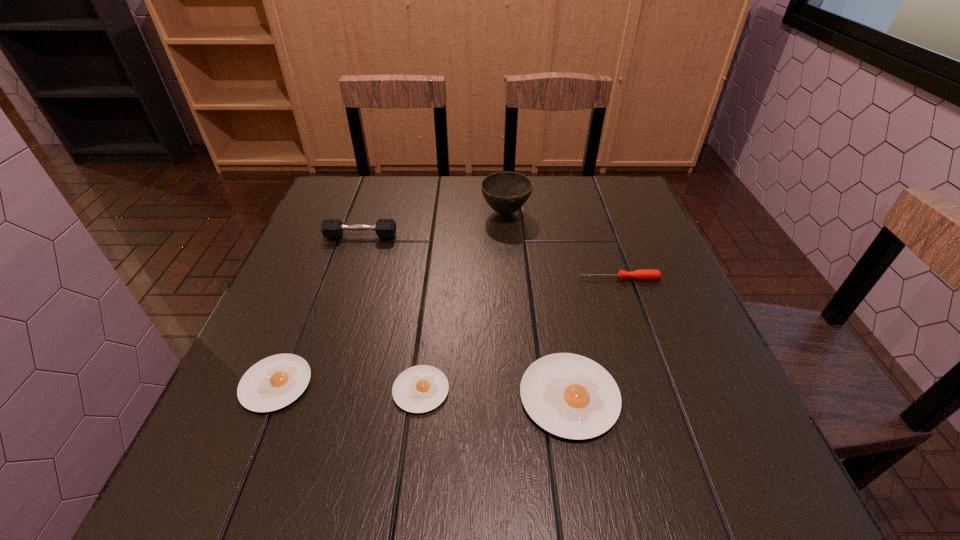
What are the coordinates of `free spot located on the right of the second shortest object` in the screenshot? It's located at (448, 384).

Identify the location of vacant area located 0.280m on the back of the second egg yolk from right to left. 435,269.

Where is `vacant space situated 0.120m on the back of the rightmost egg yolk`? Image resolution: width=960 pixels, height=540 pixels. vacant space situated 0.120m on the back of the rightmost egg yolk is located at coordinates (555, 312).

The height and width of the screenshot is (540, 960). What are the coordinates of `vacant region located at the tip of the fourth nearest object` in the screenshot? It's located at (549, 279).

Where is `free location located at the tip of the fourth nearest object`? This screenshot has height=540, width=960. free location located at the tip of the fourth nearest object is located at coordinates click(418, 279).

Locate an element on the screen. The image size is (960, 540). vacant point located 0.270m at the tip of the fourth nearest object is located at coordinates (462, 279).

In order to click on vacant space located on the right of the tallest object in this screenshot , I will do `click(586, 213)`.

Identify the location of vacant area situated on the front of the dumbbell. This screenshot has height=540, width=960. (343, 291).

I want to click on object at the far edge, so pos(506,192).

You are a GUI agent. You are given a task and a screenshot of the screen. Output one action in this format:
    pyautogui.click(x=<x>, y=<y>)
    Task: Click on the egg yolk present at the left edge
    
    Given the screenshot: What is the action you would take?
    pyautogui.click(x=276, y=381)